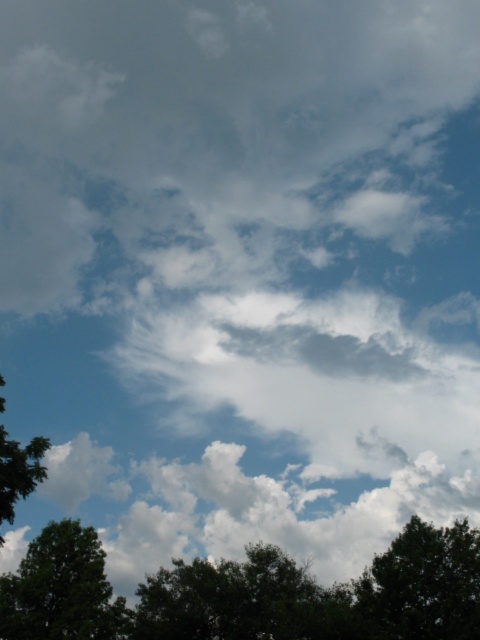
Is green leafy tree at lower center smaller than green leafy tree at left?

Yes.

Does green leafy tree at lower center have a greater width compared to green leafy tree at left?

Yes.

I want to click on green leafy tree at lower center, so click(240, 600).

Who is positioned more to the right, green leafy tree at lower center or green leafy tree at lower left?

Positioned to the right is green leafy tree at lower center.

Locate an element on the screen. green leafy tree at lower center is located at coordinates (240, 600).

The width and height of the screenshot is (480, 640). What are the coordinates of `green leafy tree at lower center` in the screenshot? It's located at (240, 600).

Between point (276, 600) and point (420, 627), which one is positioned in front?

Point (420, 627) is in front.

Is point (290, 561) positioned before point (364, 584)?

No, it is not.

Is point (223, 627) positioned in front of point (372, 592)?

No, (223, 627) is further to viewer.

Where is `green leafy tree at lower center`? The width and height of the screenshot is (480, 640). green leafy tree at lower center is located at coordinates (240, 600).